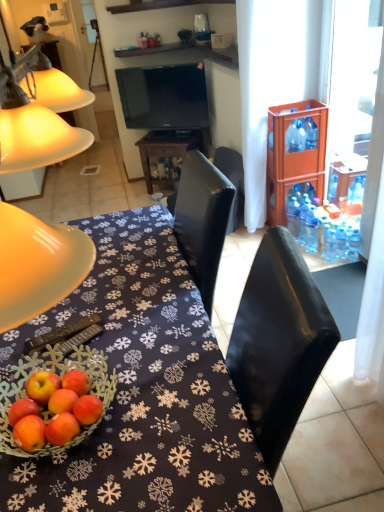
Locate an element on the screen. clear plastic bottle at right, marked as the 3th bottle in a left-to-right arrangement is located at coordinates (353, 245).

The width and height of the screenshot is (384, 512). Describe the element at coordinates (168, 148) in the screenshot. I see `black glossy table at center` at that location.

Where is `black glossy table at center`? black glossy table at center is located at coordinates (168, 148).

Describe the element at coordinates (164, 97) in the screenshot. I see `black glossy television at upper center` at that location.

This screenshot has width=384, height=512. Describe the element at coordinates (142, 390) in the screenshot. I see `brown fabric table at center` at that location.

Find the location of a particular element. clear plastic bottle at right, which is the third bottle in top-to-bottom order is located at coordinates (353, 245).

Considering the sizes of objects clear plastic bottle at right, which is the third bottle in top-to-bottom order, and clear plastic bottle at right, acting as the third bottle starting from the right, in the image provided, who is bigger, clear plastic bottle at right, which is the third bottle in top-to-bottom order, or clear plastic bottle at right, acting as the third bottle starting from the right,?

With larger size is clear plastic bottle at right, acting as the third bottle starting from the right.

Who is taller, clear plastic bottle at right, placed as the first bottle when sorted from right to left, or clear plastic bottle at right, which appears as the 2th bottle when ordered from the bottom?

With more height is clear plastic bottle at right, which appears as the 2th bottle when ordered from the bottom.

Considering the positions of objects clear plastic bottle at right, which ranks as the first bottle in bottom-to-top order, and clear plastic bottle at right, which is the 2th bottle from top to bottom, in the image provided, who is more to the right, clear plastic bottle at right, which ranks as the first bottle in bottom-to-top order, or clear plastic bottle at right, which is the 2th bottle from top to bottom,?

clear plastic bottle at right, which ranks as the first bottle in bottom-to-top order.

From a real-world perspective, relative to clear plastic bottle at right, which is the third bottle in top-to-bottom order, is black matte remote control at lower left vertically above or below?

From a real-world perspective, black matte remote control at lower left is physically above clear plastic bottle at right, which is the third bottle in top-to-bottom order.

From the image's perspective, which object appears higher, black matte remote control at lower left or clear plastic bottle at right, marked as the 3th bottle in a left-to-right arrangement?

clear plastic bottle at right, marked as the 3th bottle in a left-to-right arrangement, appears higher in the image.

Considering the relative sizes of black matte remote control at lower left and clear plastic bottle at right, placed as the first bottle when sorted from right to left, in the image provided, is black matte remote control at lower left bigger than clear plastic bottle at right, placed as the first bottle when sorted from right to left,?

Actually, black matte remote control at lower left might be smaller than clear plastic bottle at right, placed as the first bottle when sorted from right to left.

Considering the positions of point (153, 105) and point (351, 236), is point (153, 105) closer or farther from the camera than point (351, 236)?

Clearly, point (153, 105) is more distant from the camera than point (351, 236).

How many degrees apart are the facing directions of black glossy television at upper center and clear plastic bottle at right, marked as the 3th bottle in a left-to-right arrangement?

There is a 57.3-degree angle between the facing directions of black glossy television at upper center and clear plastic bottle at right, marked as the 3th bottle in a left-to-right arrangement.

Considering the relative sizes of black glossy television at upper center and clear plastic bottle at right, which is the third bottle in top-to-bottom order, in the image provided, is black glossy television at upper center smaller than clear plastic bottle at right, which is the third bottle in top-to-bottom order,?

No.

From a real-world perspective, which object stands above the other?

black glossy television at upper center is physically above.

Which is more to the right, matte yellow lampshade at left or black glossy television at upper center?

From the viewer's perspective, black glossy television at upper center appears more on the right side.

From the image's perspective, is matte yellow lampshade at left under black glossy television at upper center?

Incorrect, from the image's perspective, matte yellow lampshade at left is higher than black glossy television at upper center.

Identify the location of television located in front of the matte yellow lampshade at left. The height and width of the screenshot is (512, 384). (164, 97).

Can we say matte yellow lampshade at left lies outside black glossy television at upper center?

Yes.

Which object is closer to the camera, matte yellow lampshade at left or brown fabric table at center?

brown fabric table at center is more forward.

From the picture: Is matte yellow lampshade at left not within brown fabric table at center?

matte yellow lampshade at left lies outside brown fabric table at center's area.

Considering the sizes of matte yellow lampshade at left and brown fabric table at center in the image, is matte yellow lampshade at left wider or thinner than brown fabric table at center?

matte yellow lampshade at left is thinner than brown fabric table at center.

Considering the sizes of objects matte yellow lampshade at left and brown fabric table at center in the image provided, who is taller, matte yellow lampshade at left or brown fabric table at center?

matte yellow lampshade at left.

Considering the positions of objects blue plastic bottle at right, the second bottle when ordered from left to right, and brown fabric table at center in the image provided, who is in front, blue plastic bottle at right, the second bottle when ordered from left to right, or brown fabric table at center?

brown fabric table at center is in front.

Can you confirm if blue plastic bottle at right, the 2th bottle in the right-to-left sequence, is bigger than brown fabric table at center?

Incorrect, blue plastic bottle at right, the 2th bottle in the right-to-left sequence, is not larger than brown fabric table at center.

What's the angular difference between blue plastic bottle at right, the second bottle when ordered from left to right, and brown fabric table at center's facing directions?

The angular difference between blue plastic bottle at right, the second bottle when ordered from left to right, and brown fabric table at center is 3.51 degrees.

Is point (8, 169) in front of point (307, 138)?

Yes, point (8, 169) is in front of point (307, 138).

From a real-world perspective, is matte yellow lampshade at left below blue plastic bottle at right, the 3th bottle ordered from the bottom?

Indeed, from a real-world perspective, matte yellow lampshade at left is positioned beneath blue plastic bottle at right, the 3th bottle ordered from the bottom.

Can you tell me how much matte yellow lampshade at left and blue plastic bottle at right, the 2th bottle in the right-to-left sequence, differ in facing direction?

The angle between the facing direction of matte yellow lampshade at left and the facing direction of blue plastic bottle at right, the 2th bottle in the right-to-left sequence, is 144 degrees.

Are matte yellow lampshade at left and blue plastic bottle at right, the 3th bottle ordered from the bottom, located far from each other?

matte yellow lampshade at left is far away from blue plastic bottle at right, the 3th bottle ordered from the bottom.

There is a clear plastic bottle at right, which ranks as the first bottle in bottom-to-top order. Identify the location of the 1st bottle above it (from the image's perspective). The width and height of the screenshot is (384, 512). (293, 210).

Locate an element on the screen. This screenshot has width=384, height=512. remote control located above the clear plastic bottle at right, which is the third bottle in top-to-bottom order (from a real-world perspective) is located at coordinates (67, 335).

Based on their spatial positions, is black glossy table at center or matte yellow lampshade at left closer to black matte remote control at lower left?

matte yellow lampshade at left.

From the image, which object appears to be nearer to black matte remote control at lower left, matte yellow lampshade at left or clear plastic bottle at right, which is the third bottle in top-to-bottom order?

Among the two, matte yellow lampshade at left is located nearer to black matte remote control at lower left.

When comparing their distances from black matte remote control at lower left, does brown fabric table at center or black glossy television at upper center seem closer?

brown fabric table at center.

Looking at the image, which one is located closer to blue plastic bottle at right, the 2th bottle in the right-to-left sequence, black leather chair at center or black glossy television at upper center?

black leather chair at center is positioned closer to the anchor blue plastic bottle at right, the 2th bottle in the right-to-left sequence.

Estimate the real-world distances between objects in this image. Which object is further from clear plastic bottle at right, which appears as the 2th bottle when ordered from the bottom, matte yellow lampshade at left or black leather chair at center?

matte yellow lampshade at left is further to clear plastic bottle at right, which appears as the 2th bottle when ordered from the bottom.

Based on their spatial positions, is black leather chair at center or clear plastic bottle at right, acting as the third bottle starting from the right, further from matte yellow lampshade at left?

clear plastic bottle at right, acting as the third bottle starting from the right.

Which object lies nearer to the anchor point black leather chair at center, black glossy table at center or black matte remote control at lower left?

black glossy table at center is closer to black leather chair at center.

Which object lies further to the anchor point black glossy table at center, clear plastic bottle at right, positioned as the first bottle in left-to-right order, or blue plastic bottle at right, which appears as the 1th bottle when viewed from the top?

blue plastic bottle at right, which appears as the 1th bottle when viewed from the top, is further to black glossy table at center.

At what (x,y) coordinates should I click in order to perform the action: click on television between black matte remote control at lower left and black glossy table at center in the front-back direction. Please return your answer as a coordinate pair (x, y). Image resolution: width=384 pixels, height=512 pixels. Looking at the image, I should click on (164, 97).

The image size is (384, 512). Identify the location of remote control located between brown fabric table at center and black glossy television at upper center in the depth direction. (67, 335).

Locate an element on the screen. chair between black glossy table at center and clear plastic bottle at right, which is the third bottle in top-to-bottom order, from left to right is located at coordinates (232, 181).

This screenshot has height=512, width=384. In order to click on television between brown fabric table at center and matte yellow lampshade at left from front to back in this screenshot , I will do `click(164, 97)`.